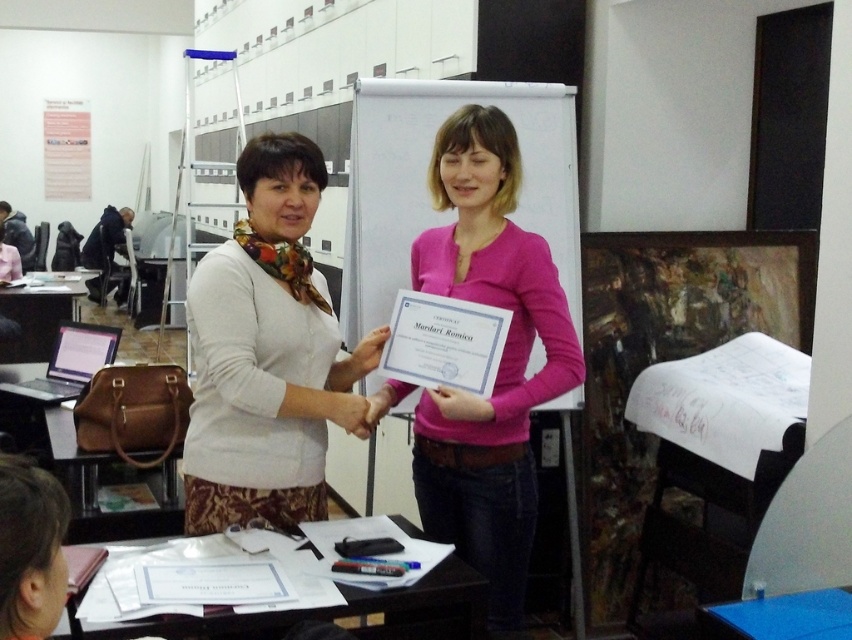
You are an event organizer who needs to arrange the white matte sweater at center and the pink matte sweater at center for a photoshoot. Which sweater should be placed in front to ensure both are visible in the photo?

The white matte sweater at center should be placed in front of the pink matte sweater at center because it is positioned over the pink matte sweater at center in the original image, indicating it is closer to the viewer.

You are organizing a charity event and need to decide which sweater to display. Both the white matte sweater at center and the pink matte sweater at center are available. Based on their sizes, which one would you choose if you want the larger one?

The pink matte sweater at center is larger than the white matte sweater at center, so you should choose the pink matte sweater at center for display.

You are an event planner organizing a photo shoot in the conference room. You need to position two models wearing the white matte sweater at center and the pink matte sweater at center so that they are facing each other. According to the scene description, which model should stand on the left side to maintain their original positions relative to each other?

The white matte sweater at center should stand on the left side because in the original scene, the white matte sweater at center is already positioned to the left of the pink matte sweater at center.